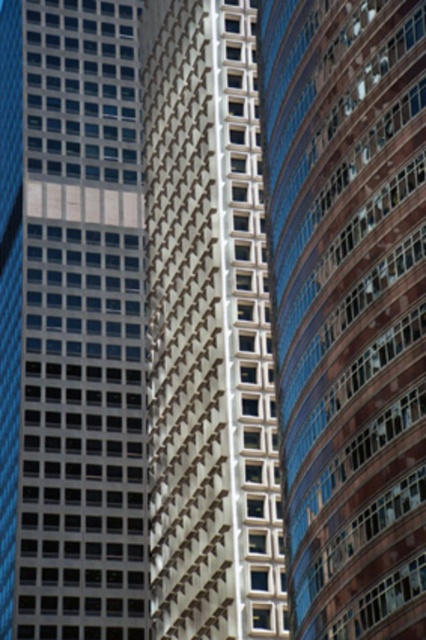
Question: Which object appears farthest from the camera in this image?

Choices:
 (A) matte glass skyscraper at center
 (B) smooth glass skyscraper at center
 (C) white textured building at center

Answer: (A)

Question: Can you confirm if matte glass skyscraper at center is bigger than white textured building at center?

Choices:
 (A) no
 (B) yes

Answer: (B)

Question: Which point is closer to the camera taking this photo?

Choices:
 (A) (250, 499)
 (B) (279, 28)
 (C) (100, 124)

Answer: (A)

Question: Can you confirm if smooth glass skyscraper at center is positioned below white textured building at center?

Choices:
 (A) yes
 (B) no

Answer: (A)

Question: Estimate the real-world distances between objects in this image. Which object is closer to the white textured building at center?

Choices:
 (A) smooth glass skyscraper at center
 (B) matte glass skyscraper at center

Answer: (A)

Question: Is smooth glass skyscraper at center thinner than matte glass skyscraper at center?

Choices:
 (A) no
 (B) yes

Answer: (B)